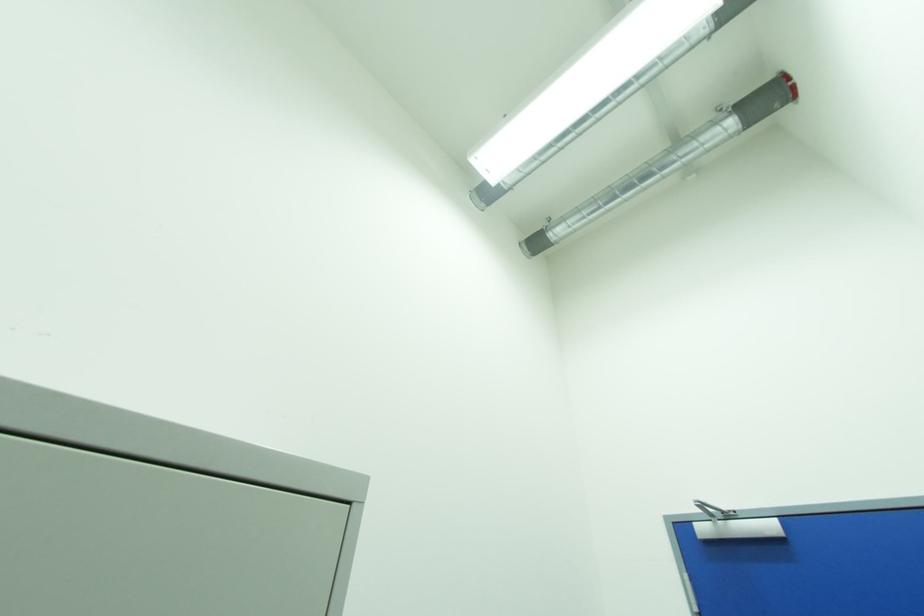
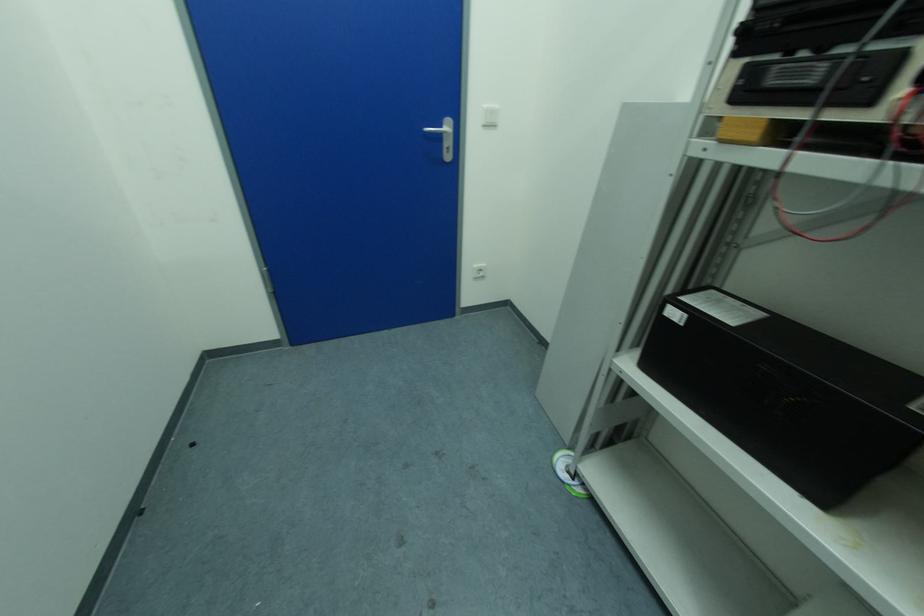
The images are taken continuously from a first-person perspective. In which direction is your viewpoint rotating?

The camera rotated toward right-down.